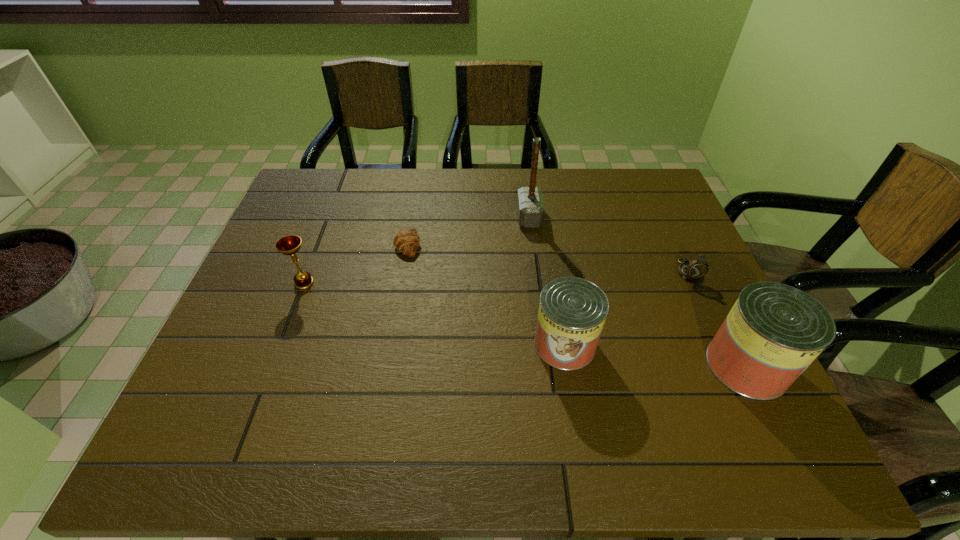
Where is `vacant position in the image that satisfies the following two spatial constraints: 1. on the striking surface of the farthest object; 2. on the front side of the shortest object`? This screenshot has width=960, height=540. vacant position in the image that satisfies the following two spatial constraints: 1. on the striking surface of the farthest object; 2. on the front side of the shortest object is located at coordinates (533, 244).